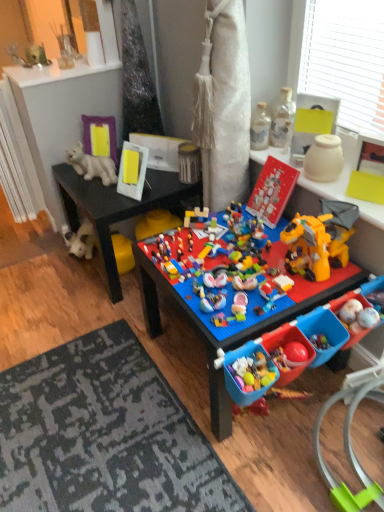
Question: Considering the relative sizes of blue plastic table at center and clear glass bottle at upper right, the third toy in the right-to-left sequence, in the image provided, is blue plastic table at center wider than clear glass bottle at upper right, the third toy in the right-to-left sequence,?

Choices:
 (A) yes
 (B) no

Answer: (A)

Question: Can you confirm if blue plastic table at center is taller than clear glass bottle at upper right, the third toy in the right-to-left sequence?

Choices:
 (A) yes
 (B) no

Answer: (A)

Question: Is blue plastic table at center to the right of clear glass bottle at upper right, the fifth toy when ordered from left to right, from the viewer's perspective?

Choices:
 (A) no
 (B) yes

Answer: (A)

Question: Is there a large distance between blue plastic table at center and clear glass bottle at upper right, the third toy in the right-to-left sequence?

Choices:
 (A) yes
 (B) no

Answer: (B)

Question: Is blue plastic table at center turned away from clear glass bottle at upper right, the third toy in the right-to-left sequence?

Choices:
 (A) yes
 (B) no

Answer: (B)

Question: Looking at their shapes, would you say white matte polar bear at upper left, which is the sixth toy in right-to-left order, is wider or thinner than white textured radiator at left?

Choices:
 (A) thin
 (B) wide

Answer: (A)

Question: Based on their sizes in the image, would you say white matte polar bear at upper left, which is the sixth toy in right-to-left order, is bigger or smaller than white textured radiator at left?

Choices:
 (A) big
 (B) small

Answer: (B)

Question: From the image's perspective, is white matte polar bear at upper left, which is the 2th toy in left-to-right order, located above or below white textured radiator at left?

Choices:
 (A) below
 (B) above

Answer: (A)

Question: From a real-world perspective, is white matte polar bear at upper left, which is the 2th toy in left-to-right order, physically located above or below white textured radiator at left?

Choices:
 (A) below
 (B) above

Answer: (B)

Question: From a real-world perspective, is white textured radiator at left above or below white matte polar bear at upper left, which is the 2th toy in left-to-right order?

Choices:
 (A) below
 (B) above

Answer: (A)

Question: Considering the positions of white textured radiator at left and white matte polar bear at upper left, which is the 2th toy in left-to-right order, in the image, is white textured radiator at left wider or thinner than white matte polar bear at upper left, which is the 2th toy in left-to-right order,?

Choices:
 (A) wide
 (B) thin

Answer: (A)

Question: Based on their positions, is white textured radiator at left located to the left or right of white matte polar bear at upper left, which is the 2th toy in left-to-right order?

Choices:
 (A) left
 (B) right

Answer: (A)

Question: In the image, is white textured radiator at left positioned in front of or behind white matte polar bear at upper left, which is the sixth toy in right-to-left order?

Choices:
 (A) behind
 (B) front

Answer: (A)

Question: Is matte plastic toy at center, the second toy when ordered from right to left, bigger or smaller than white matte vase at upper right, marked as the 7th toy in a left-to-right arrangement?

Choices:
 (A) small
 (B) big

Answer: (B)

Question: From the image's perspective, is matte plastic toy at center, which is the 6th toy from left to right, positioned above or below white matte vase at upper right, marked as the 7th toy in a left-to-right arrangement?

Choices:
 (A) above
 (B) below

Answer: (B)